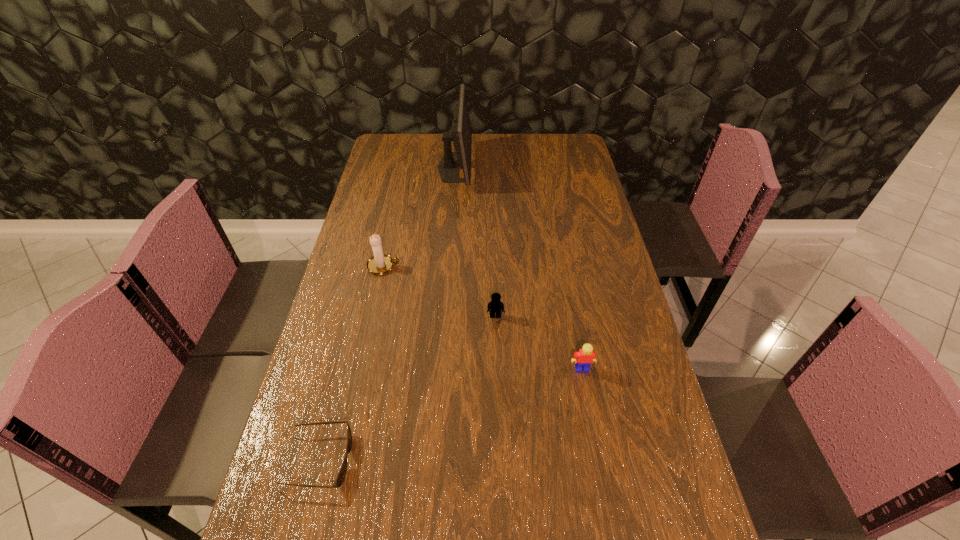
Where is `computer monitor`? The width and height of the screenshot is (960, 540). computer monitor is located at coordinates (461, 135).

Where is `the tallest object`? The width and height of the screenshot is (960, 540). the tallest object is located at coordinates (461, 135).

The image size is (960, 540). In order to click on candle holder in this screenshot , I will do `click(380, 263)`.

This screenshot has height=540, width=960. What are the coordinates of `the fourth shortest object` in the screenshot? It's located at (380, 263).

Image resolution: width=960 pixels, height=540 pixels. I want to click on the fourth farthest object, so 584,358.

In order to click on the nearer Lego in this screenshot , I will do `click(584, 358)`.

What are the coordinates of `the fourth tallest object` in the screenshot? It's located at (495, 306).

The width and height of the screenshot is (960, 540). In order to click on the fourth object from left to right in this screenshot , I will do `click(495, 306)`.

The image size is (960, 540). Find the location of `the nearest object`. the nearest object is located at coordinates (340, 478).

Find the location of a particular element. The height and width of the screenshot is (540, 960). the shortest object is located at coordinates (340, 478).